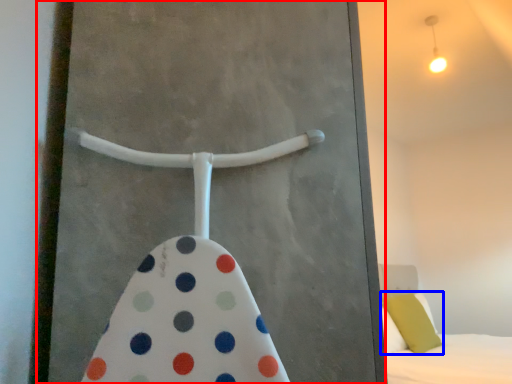
Question: Which of the following is the closest to the observer, screen door (highlighted by a red box) or pillow (highlighted by a blue box)?

Choices:
 (A) screen door
 (B) pillow

Answer: (A)